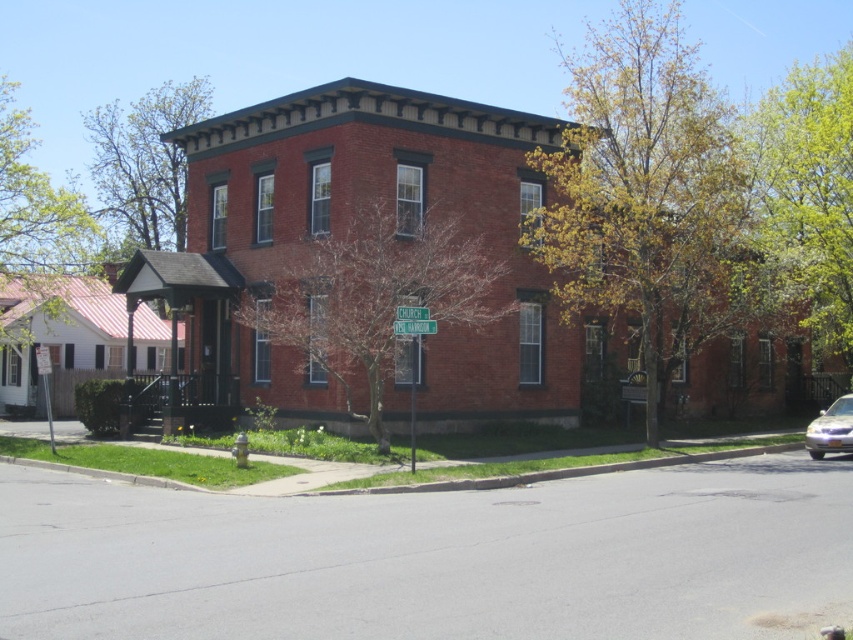
Does green leafy tree at center lie behind bare branches at center?

Yes, green leafy tree at center is further from the viewer.

The width and height of the screenshot is (853, 640). Describe the element at coordinates (646, 193) in the screenshot. I see `green leafy tree at center` at that location.

I want to click on green leafy tree at center, so click(646, 193).

The height and width of the screenshot is (640, 853). What do you see at coordinates (375, 300) in the screenshot?
I see `bare branches at center` at bounding box center [375, 300].

Which is more to the right, bare branches at center or green leafy tree at upper right?

green leafy tree at upper right is more to the right.

Does point (287, 344) come behind point (810, 225)?

No.

Find the location of `bare branches at center`. bare branches at center is located at coordinates (375, 300).

Locate an element on the screen. The width and height of the screenshot is (853, 640). green leafy tree at center is located at coordinates (646, 193).

Which is behind, point (625, 182) or point (12, 166)?

The point (12, 166) is more distant.

Identify the location of green leafy tree at center. (646, 193).